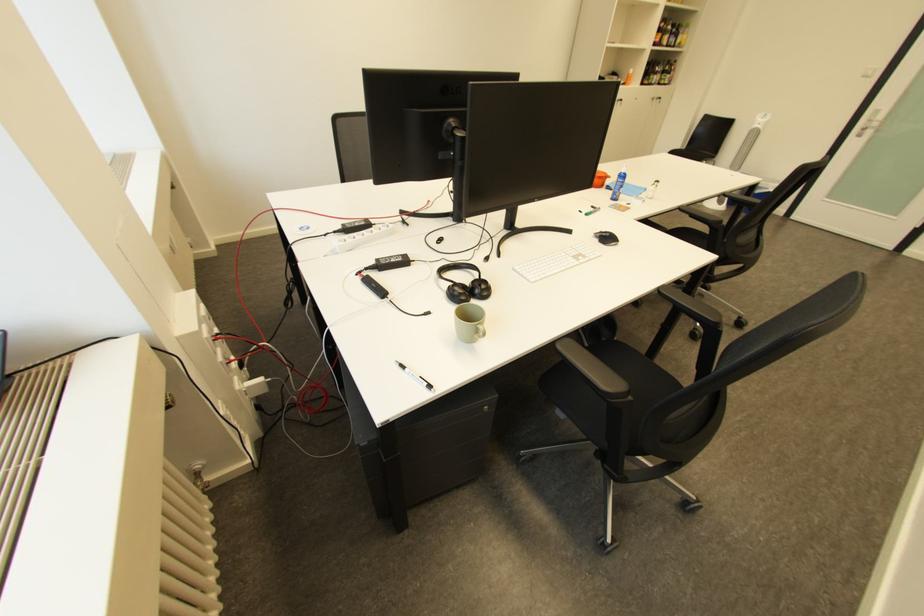
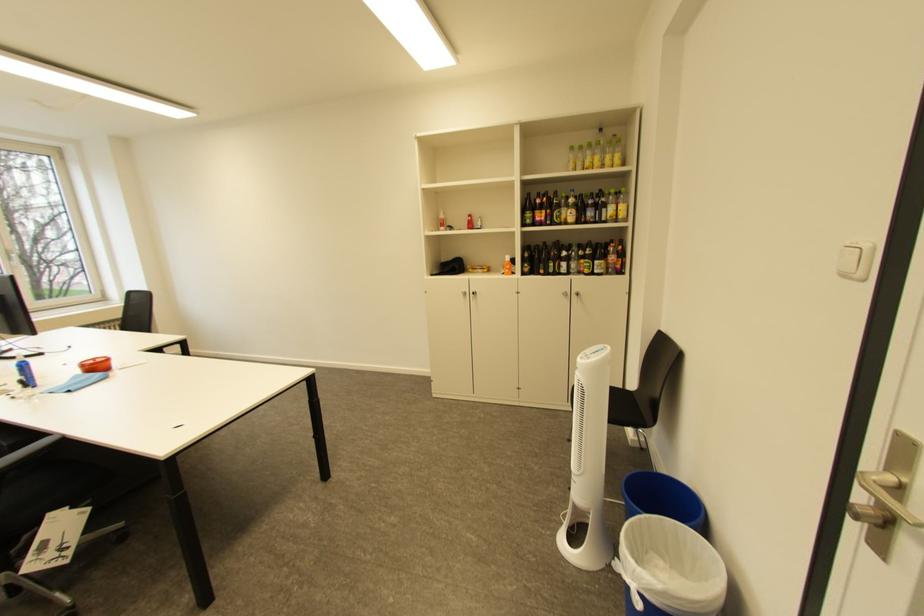
Find the pixel in the second image that matches [661,78] in the first image.

(562, 265)